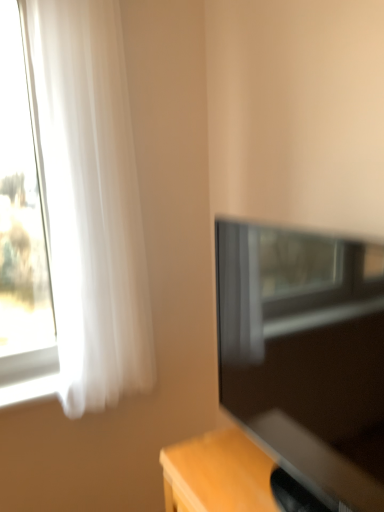
What do you see at coordinates (91, 202) in the screenshot? I see `white sheer curtain at left` at bounding box center [91, 202].

Where is `white sheer curtain at left`? This screenshot has height=512, width=384. white sheer curtain at left is located at coordinates (91, 202).

The height and width of the screenshot is (512, 384). In order to click on matte black tv at right in this screenshot , I will do `click(306, 351)`.

What do you see at coordinates (306, 351) in the screenshot? I see `matte black tv at right` at bounding box center [306, 351].

Image resolution: width=384 pixels, height=512 pixels. I want to click on white sheer curtain at left, so click(x=91, y=202).

Based on the photo, in the image, is matte black tv at right on the left side or the right side of white sheer curtain at left?

Based on their positions, matte black tv at right is located to the right of white sheer curtain at left.

Does matte black tv at right lie in front of white sheer curtain at left?

Yes, matte black tv at right is closer to the viewer.

Does point (353, 490) come behind point (82, 221)?

No, it is not.

From the image's perspective, who appears lower, matte black tv at right or white sheer curtain at left?

matte black tv at right is shown below in the image.

From a real-world perspective, is matte black tv at right positioned above or below white sheer curtain at left?

Clearly, from a real-world perspective, matte black tv at right is below white sheer curtain at left.

Which of these two, matte black tv at right or white sheer curtain at left, is thinner?

white sheer curtain at left.

Can you confirm if matte black tv at right is shorter than white sheer curtain at left?

Yes, matte black tv at right is shorter than white sheer curtain at left.

Who is bigger, matte black tv at right or white sheer curtain at left?

With larger size is matte black tv at right.

Is white sheer curtain at left inside matte black tv at right?

No, white sheer curtain at left is not inside matte black tv at right.

Is matte black tv at right far away from white sheer curtain at left?

No, matte black tv at right is not far from white sheer curtain at left.

Is matte black tv at right oriented towards white sheer curtain at left?

No, matte black tv at right does not turn towards white sheer curtain at left.

Locate an element on the screen. The image size is (384, 512). television in front of the white sheer curtain at left is located at coordinates 306,351.

Considering the positions of objects white sheer curtain at left and matte black tv at right in the image provided, who is more to the right, white sheer curtain at left or matte black tv at right?

From the viewer's perspective, matte black tv at right appears more on the right side.

Which is behind, white sheer curtain at left or matte black tv at right?

white sheer curtain at left.

Is point (101, 170) closer to viewer compared to point (380, 382)?

That is False.

From the image's perspective, is white sheer curtain at left positioned above or below matte black tv at right?

white sheer curtain at left is situated higher than matte black tv at right in the image.

From a real-world perspective, relative to matte black tv at right, is white sheer curtain at left vertically above or below?

From a real-world perspective, white sheer curtain at left is physically above matte black tv at right.

Between white sheer curtain at left and matte black tv at right, which one has larger width?

Wider between the two is matte black tv at right.

Does white sheer curtain at left have a lesser height compared to matte black tv at right?

No.

Does white sheer curtain at left have a smaller size compared to matte black tv at right?

Indeed, white sheer curtain at left has a smaller size compared to matte black tv at right.

Can matte black tv at right be found inside white sheer curtain at left?

No, matte black tv at right is located outside of white sheer curtain at left.

Is there a large distance between white sheer curtain at left and matte black tv at right?

That's not correct — white sheer curtain at left is a little close to matte black tv at right.

Is white sheer curtain at left facing away from matte black tv at right?

white sheer curtain at left is not turned away from matte black tv at right.

How many degrees apart are the facing directions of white sheer curtain at left and matte black tv at right?

white sheer curtain at left and matte black tv at right are facing 86.1 degrees away from each other.

Measure the distance from white sheer curtain at left to matte black tv at right.

A distance of 25.10 inches exists between white sheer curtain at left and matte black tv at right.

The height and width of the screenshot is (512, 384). Find the location of `curtain on the left side of matte black tv at right`. curtain on the left side of matte black tv at right is located at coordinates (91, 202).

In the image, there is a white sheer curtain at left. What are the coordinates of `television below it (from a real-world perspective)` in the screenshot? It's located at (306, 351).

Where is `curtain that is behind the matte black tv at right`? This screenshot has height=512, width=384. curtain that is behind the matte black tv at right is located at coordinates (91, 202).